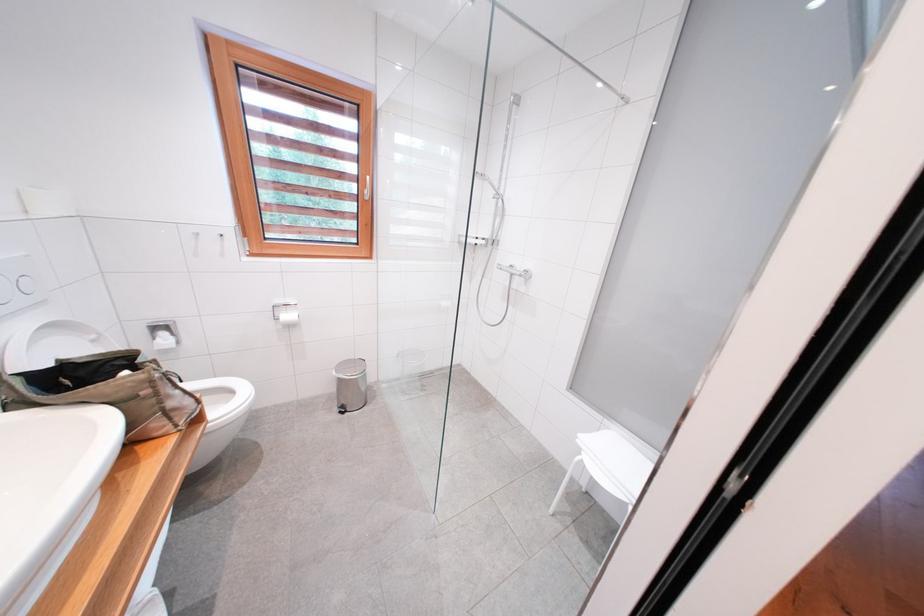
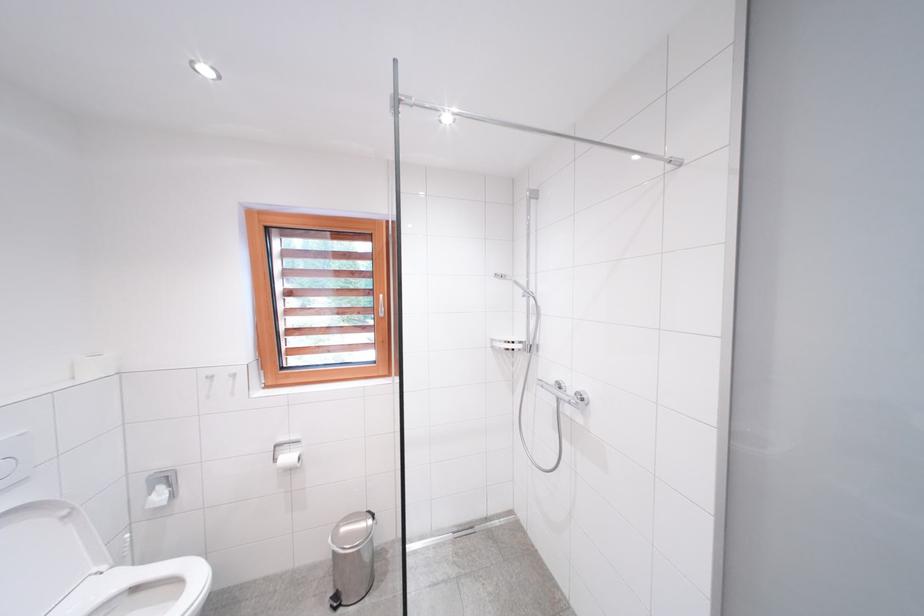
First-person continuous shooting, in which direction is the camera rotating?

The rotation direction of the camera is left-up.